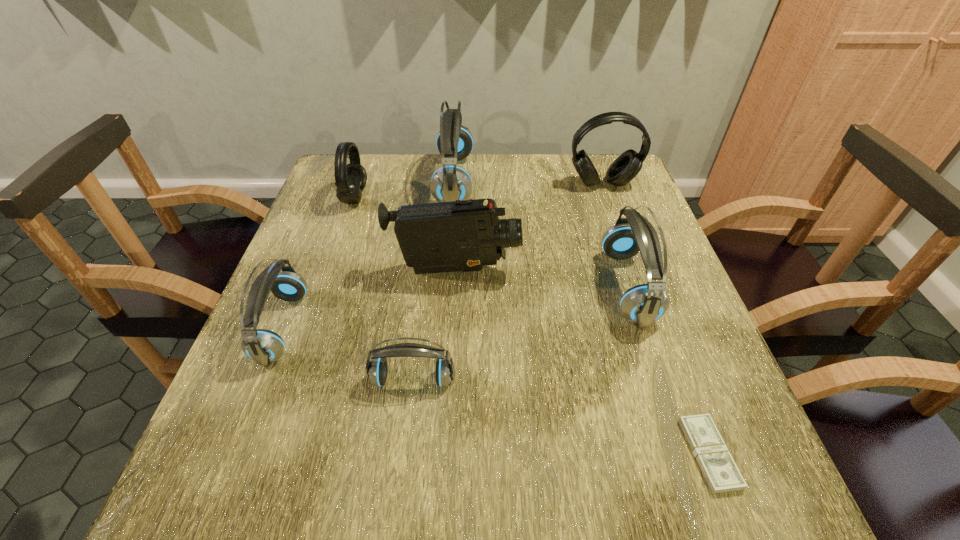
Identify the location of free region that satisfies the following two spatial constraints: 1. on the ear cups of the second biggest blue headset; 2. on the ear cups of the shortest headset. Image resolution: width=960 pixels, height=540 pixels. (658, 380).